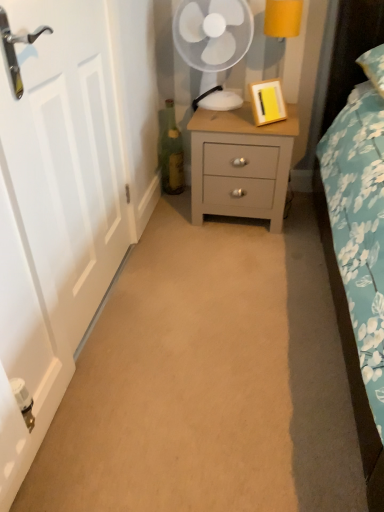
The image size is (384, 512). Find the location of `vacant area located to the right-hand side of white matte door at left`. vacant area located to the right-hand side of white matte door at left is located at coordinates (203, 296).